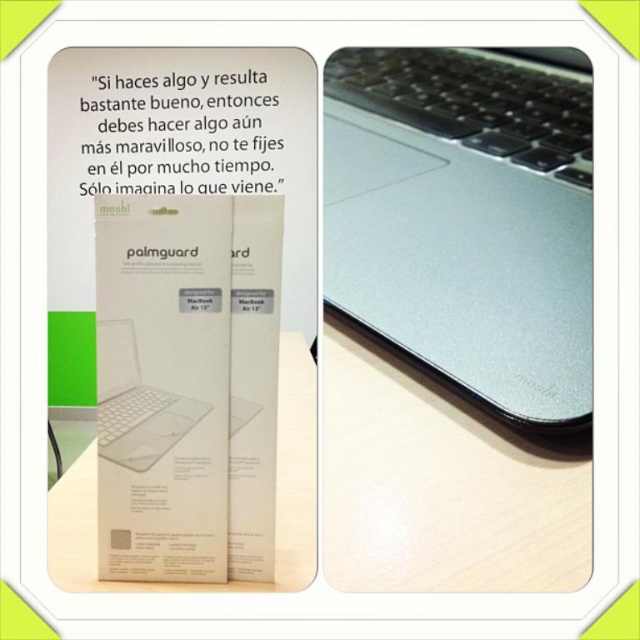
Is satin silver laptop at center behind sleek silver laptop at center?

Yes, it is behind sleek silver laptop at center.

Between point (448, 67) and point (132, 428), which one is positioned in front?

Point (132, 428) is more forward.

You are a GUI agent. You are given a task and a screenshot of the screen. Output one action in this format:
    pyautogui.click(x=<x>, y=<y>)
    Task: Click on the satin silver laptop at center
    The image size is (640, 640).
    Given the screenshot: What is the action you would take?
    pyautogui.click(x=467, y=218)

Between point (397, 563) and point (145, 582), which one is positioned in front?

Point (397, 563)

Is point (364, 422) closer to camera compared to point (244, 582)?

No, it is not.

Locate an element on the screen. wooden table at center is located at coordinates (440, 484).

Can you confirm if satin silver laptop at center is thinner than wooden table at center?

No, satin silver laptop at center is not thinner than wooden table at center.

Looking at this image, is satin silver laptop at center below wooden table at center?

Incorrect, satin silver laptop at center is not positioned below wooden table at center.

Does point (422, 93) lie in front of point (456, 564)?

No.

Find the location of a particular element. The width and height of the screenshot is (640, 640). satin silver laptop at center is located at coordinates (467, 218).